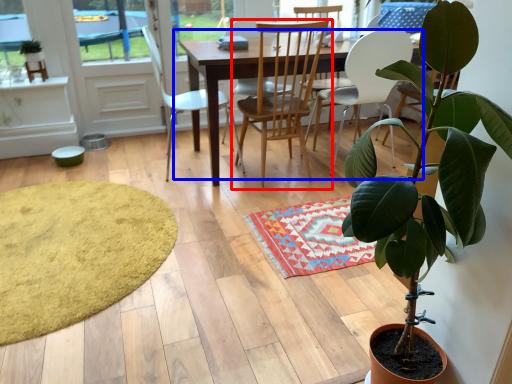
Question: Which of the following is the closest to the observer, chair (highlighted by a red box) or kitchen & dining room table (highlighted by a blue box)?

Choices:
 (A) chair
 (B) kitchen & dining room table

Answer: (A)